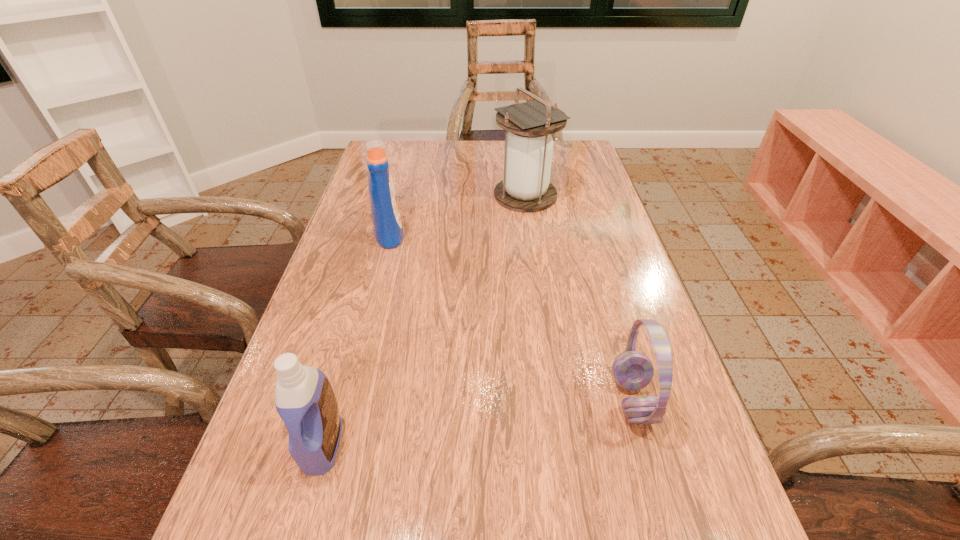
Identify the location of vacant area between the rightmost object and the farther detergent. (512, 316).

This screenshot has width=960, height=540. I want to click on vacant area that lies between the farthest object and the taller detergent, so [x=457, y=214].

Where is `unoccupied position between the third nearest object and the farthest object`? The width and height of the screenshot is (960, 540). unoccupied position between the third nearest object and the farthest object is located at coordinates (457, 214).

This screenshot has height=540, width=960. I want to click on empty location between the lantern and the nearer detergent, so click(x=424, y=320).

Image resolution: width=960 pixels, height=540 pixels. In order to click on free point between the farther detergent and the nearer detergent in this screenshot , I will do `click(356, 339)`.

What are the coordinates of `free space between the second shortest object and the rightmost object` in the screenshot? It's located at (478, 422).

Locate an element on the screen. Image resolution: width=960 pixels, height=540 pixels. object that is the closest to the taller detergent is located at coordinates (528, 148).

Select which object is the second closest to the second object from right to left. Please provide its 2D coordinates. Your answer should be formatted as a tuple, i.e. [(x, y)], where the tuple contains the x and y coordinates of a point satisfying the conditions above.

[(632, 370)]

The height and width of the screenshot is (540, 960). What are the coordinates of `vacant area that satisfies the following two spatial constraints: 1. on the back side of the third object from left to right; 2. on the right side of the nearer detergent` in the screenshot? It's located at 392,195.

Where is `free point that satisfies the following two spatial constraints: 1. on the front side of the lantern; 2. on the label of the taller detergent`? This screenshot has width=960, height=540. free point that satisfies the following two spatial constraints: 1. on the front side of the lantern; 2. on the label of the taller detergent is located at coordinates (531, 233).